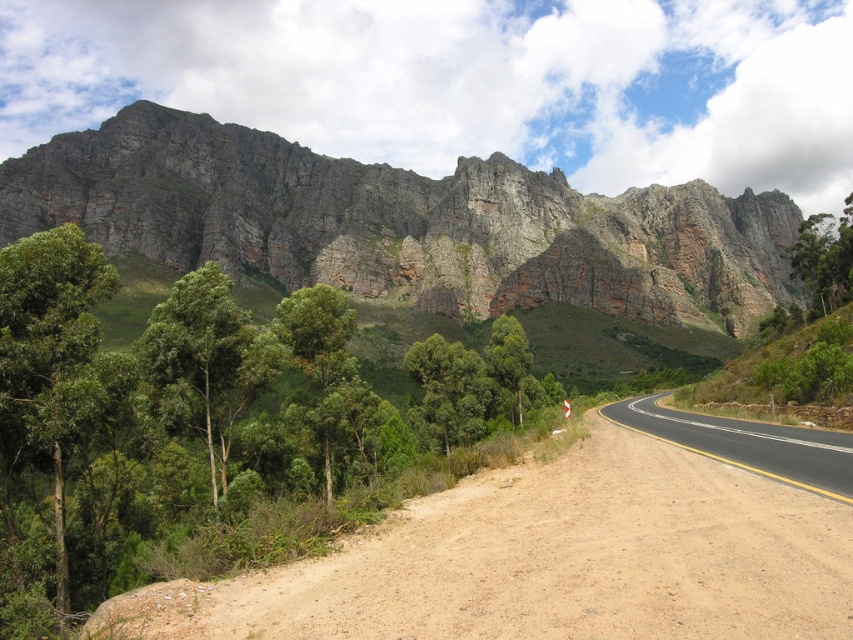
Question: Which of the following is the farthest from the observer?

Choices:
 (A) green leafy tree at left
 (B) rugged stone mountain at upper center
 (C) dirt road at lower left
 (D) green leafy tree at right

Answer: (B)

Question: Is green smooth tree at center to the left of green leafy tree at right from the viewer's perspective?

Choices:
 (A) no
 (B) yes

Answer: (B)

Question: Is green leafy tree at left to the left of rugged stone mountain at upper center from the viewer's perspective?

Choices:
 (A) no
 (B) yes

Answer: (B)

Question: Among these objects, which one is nearest to the camera?

Choices:
 (A) green leafy tree at right
 (B) green smooth tree at center

Answer: (B)

Question: Which object is positioned farthest from the green leafy tree at right?

Choices:
 (A) green smooth tree at center
 (B) rugged stone mountain at upper center
 (C) dirt road at lower left
 (D) green leafy tree at left

Answer: (A)

Question: Can you confirm if rugged stone mountain at upper center is wider than green smooth tree at center?

Choices:
 (A) yes
 (B) no

Answer: (A)